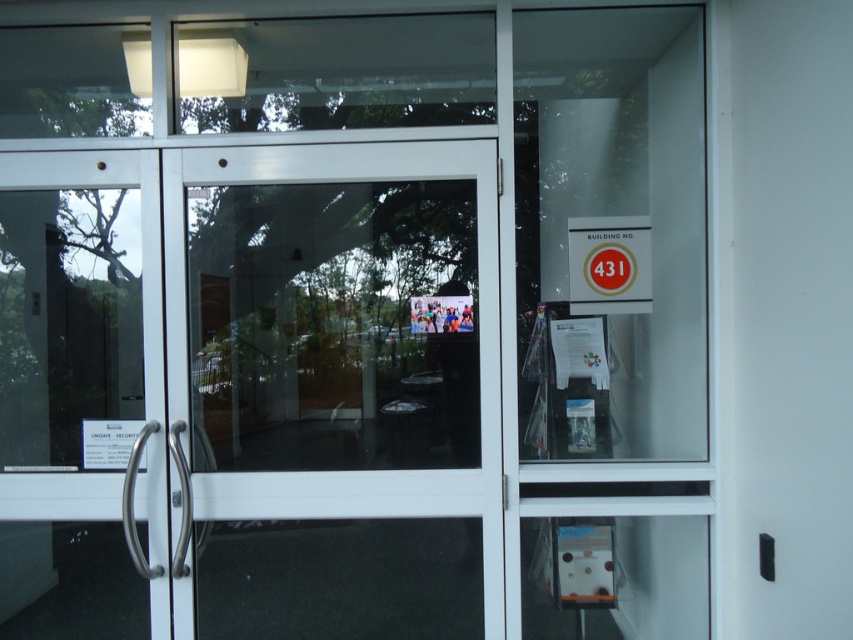
Who is taller, transparent glass door at center or matte gold sign at upper right?

transparent glass door at center

Who is more forward, (302, 378) or (618, 266)?

Point (618, 266) is more forward.

Who is more forward, (x=380, y=141) or (x=627, y=266)?

Positioned in front is point (x=380, y=141).

At what (x,y) coordinates should I click in order to perform the action: click on transparent glass door at center. Please return your answer as a coordinate pair (x, y). This screenshot has width=853, height=640. Looking at the image, I should click on [338, 387].